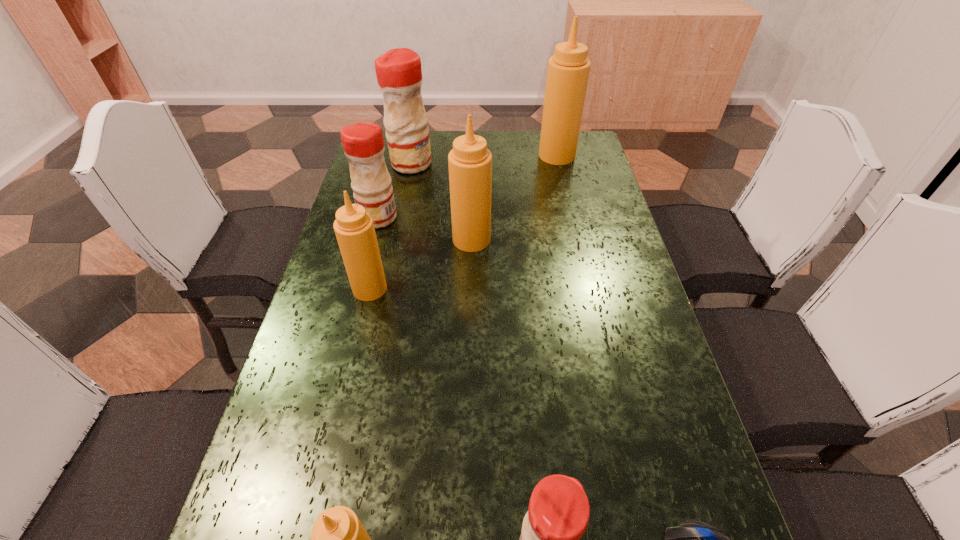
Where is `vacant space located on the back of the third tan condiment from left to right`? vacant space located on the back of the third tan condiment from left to right is located at coordinates tap(472, 205).

Find the location of a particular element. This screenshot has height=540, width=960. free space located on the back of the fifth farthest condiment is located at coordinates coord(383,234).

Where is `vacant space located 0.120m on the front of the second farthest red condiment`? The height and width of the screenshot is (540, 960). vacant space located 0.120m on the front of the second farthest red condiment is located at coordinates (368, 258).

The height and width of the screenshot is (540, 960). Find the location of `object at the right edge`. object at the right edge is located at coordinates (568, 70).

Find the location of `object located at the far left corner`. object located at the far left corner is located at coordinates (398, 71).

This screenshot has width=960, height=540. Identify the location of object located in the far right corner section of the desktop. (568, 70).

Identify the location of vacant region at the far edge. Image resolution: width=960 pixels, height=540 pixels. (497, 141).

I want to click on vacant space at the left edge of the desktop, so click(266, 500).

Where is `free space at the right edge of the desktop`? The image size is (960, 540). free space at the right edge of the desktop is located at coordinates (629, 396).

At what (x,y) coordinates should I click in order to perform the action: click on vacant area that lies between the third smallest tan condiment and the rightmost condiment. Please return your answer as a coordinate pair (x, y). The height and width of the screenshot is (540, 960). Looking at the image, I should click on point(515,198).